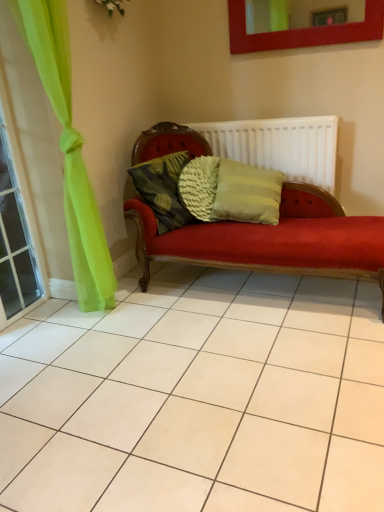
Question: Does white ribbed radiator at center appear on the left side of green sheer curtain at left?

Choices:
 (A) yes
 (B) no

Answer: (B)

Question: Is white ribbed radiator at center completely or partially outside of green sheer curtain at left?

Choices:
 (A) no
 (B) yes

Answer: (B)

Question: Is white ribbed radiator at center next to green sheer curtain at left and touching it?

Choices:
 (A) no
 (B) yes

Answer: (A)

Question: From a real-world perspective, is white ribbed radiator at center physically below green sheer curtain at left?

Choices:
 (A) no
 (B) yes

Answer: (B)

Question: Is white ribbed radiator at center not near green sheer curtain at left?

Choices:
 (A) yes
 (B) no

Answer: (A)

Question: From the image's perspective, is matte red picture frame at upper center positioned above or below green sheer curtain at left?

Choices:
 (A) above
 (B) below

Answer: (A)

Question: From a real-world perspective, is matte red picture frame at upper center physically located above or below green sheer curtain at left?

Choices:
 (A) below
 (B) above

Answer: (B)

Question: Which is correct: matte red picture frame at upper center is inside green sheer curtain at left, or outside of it?

Choices:
 (A) outside
 (B) inside

Answer: (A)

Question: Considering the positions of matte red picture frame at upper center and green sheer curtain at left in the image, is matte red picture frame at upper center taller or shorter than green sheer curtain at left?

Choices:
 (A) tall
 (B) short

Answer: (B)

Question: Based on their sizes in the image, would you say matte red picture frame at upper center is bigger or smaller than white ribbed radiator at center?

Choices:
 (A) big
 (B) small

Answer: (B)

Question: Is point (258, 39) positioned closer to the camera than point (291, 161)?

Choices:
 (A) farther
 (B) closer

Answer: (B)

Question: From the image's perspective, is matte red picture frame at upper center located above or below white ribbed radiator at center?

Choices:
 (A) above
 (B) below

Answer: (A)

Question: Is matte red picture frame at upper center taller or shorter than white ribbed radiator at center?

Choices:
 (A) tall
 (B) short

Answer: (B)

Question: From a real-world perspective, is woven fabric pillow at center physically located above or below green sheer curtain at left?

Choices:
 (A) above
 (B) below

Answer: (B)

Question: From the image's perspective, relative to green sheer curtain at left, is woven fabric pillow at center above or below?

Choices:
 (A) below
 (B) above

Answer: (B)